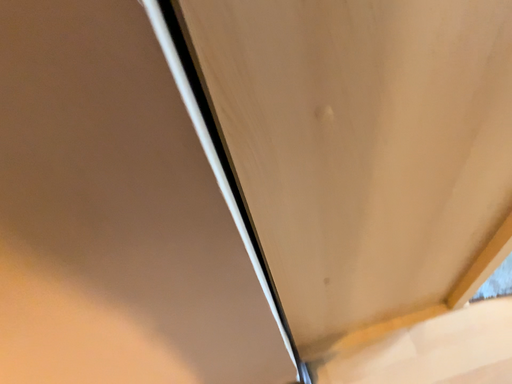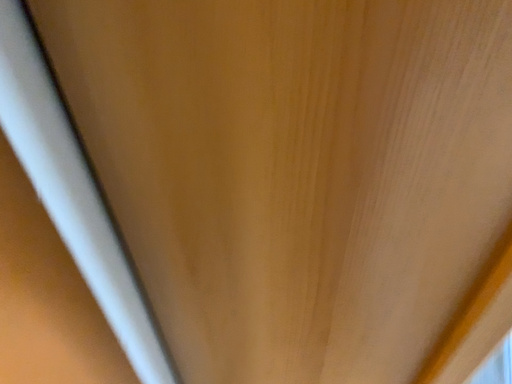
Question: How did the camera likely rotate when shooting the video?

Choices:
 (A) rotated downward
 (B) rotated upward

Answer: (B)